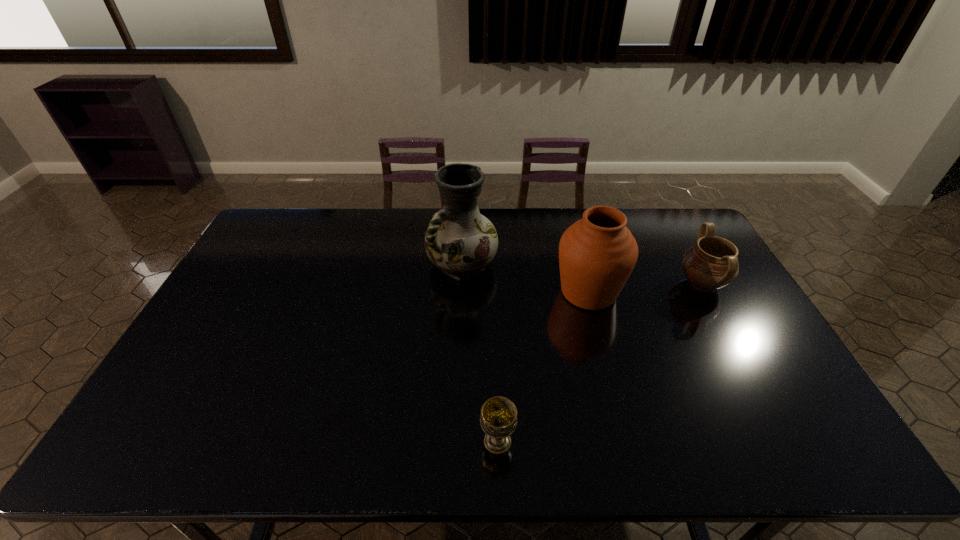
You are a GUI agent. You are given a task and a screenshot of the screen. Output one action in this format:
    pyautogui.click(x=<x>, y=<y>)
    Task: Click on the vacant space situated on the front-facing side of the rightmost object
    The image size is (960, 540).
    Given the screenshot: What is the action you would take?
    [557, 284]

Where is `free space located 0.380m on the front-facing side of the rightmost object`? The width and height of the screenshot is (960, 540). free space located 0.380m on the front-facing side of the rightmost object is located at coordinates (560, 284).

At what (x,y) coordinates should I click in order to perform the action: click on vacant region located 0.240m on the left of the chalice. Please return your answer as a coordinate pair (x, y). This screenshot has height=540, width=960. Looking at the image, I should click on (377, 441).

The height and width of the screenshot is (540, 960). I want to click on object situated at the far edge, so click(460, 241).

Locate an element on the screen. object at the near edge is located at coordinates (498, 419).

You are a GUI agent. You are given a task and a screenshot of the screen. Output one action in this format:
    pyautogui.click(x=<x>, y=<y>)
    Task: Click on the object present at the right edge
    The image size is (960, 540).
    Given the screenshot: What is the action you would take?
    pyautogui.click(x=711, y=263)

In the image, there is a desktop. Where is `free space at the far edge`? The width and height of the screenshot is (960, 540). free space at the far edge is located at coordinates (390, 212).

The width and height of the screenshot is (960, 540). In the image, there is a desktop. What are the coordinates of `vacant region at the near edge` in the screenshot? It's located at (640, 438).

Locate an element on the screen. free space at the left edge of the desktop is located at coordinates tap(193, 394).

You are a GUI agent. You are given a task and a screenshot of the screen. Output one action in this format:
    pyautogui.click(x=<x>, y=<y>)
    Task: Click on the vacant area at the right edge of the desktop
    Image resolution: width=960 pixels, height=540 pixels.
    Given the screenshot: What is the action you would take?
    pyautogui.click(x=765, y=418)